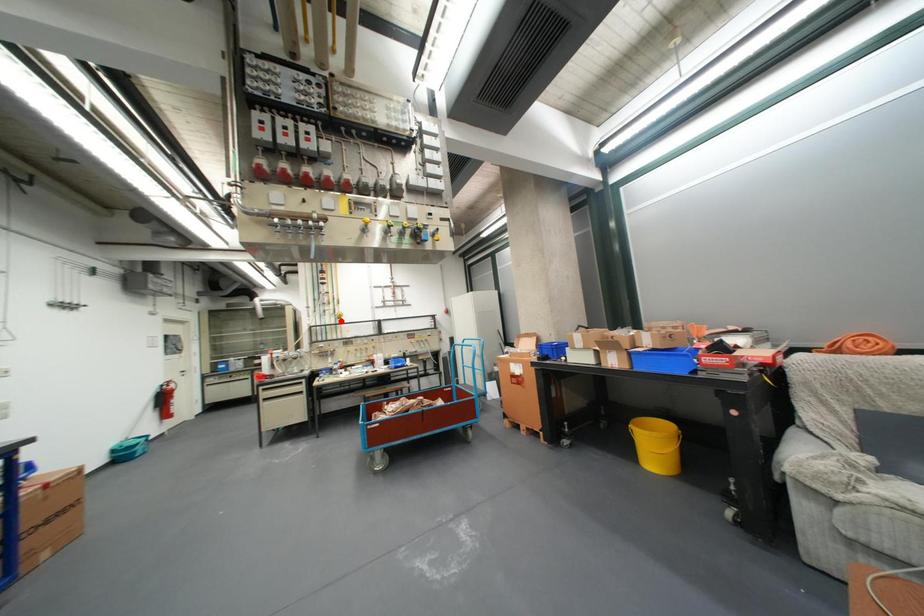
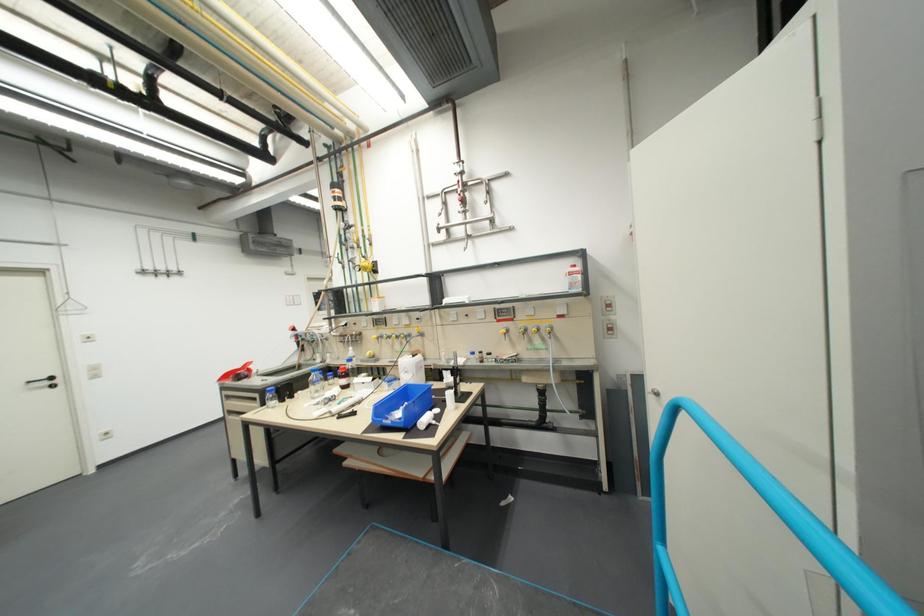
Locate, in the second image, the point that corresponds to the highlighted location in the first image.

(373, 278)